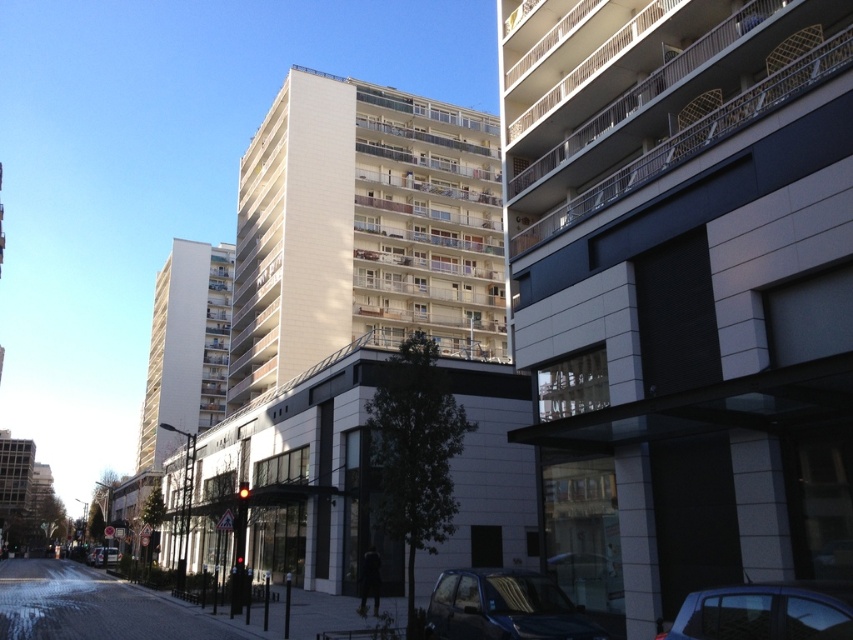
Question: Can you confirm if shiny blue car at lower center is positioned to the left of metallic silver car at lower left?

Choices:
 (A) yes
 (B) no

Answer: (B)

Question: Which object is the closest to the metallic blue car at lower right?

Choices:
 (A) metallic silver car at lower left
 (B) shiny blue car at lower center

Answer: (B)

Question: Which object is the closest to the shiny blue car at lower center?

Choices:
 (A) metallic silver car at lower left
 (B) metallic blue car at lower right

Answer: (B)

Question: Among these objects, which one is farthest from the camera?

Choices:
 (A) metallic silver car at lower left
 (B) shiny blue car at lower center

Answer: (A)

Question: Does metallic blue car at lower right come in front of metallic silver car at lower left?

Choices:
 (A) yes
 (B) no

Answer: (A)

Question: Considering the relative positions of shiny blue car at lower center and metallic blue car at lower right in the image provided, where is shiny blue car at lower center located with respect to metallic blue car at lower right?

Choices:
 (A) left
 (B) right

Answer: (A)